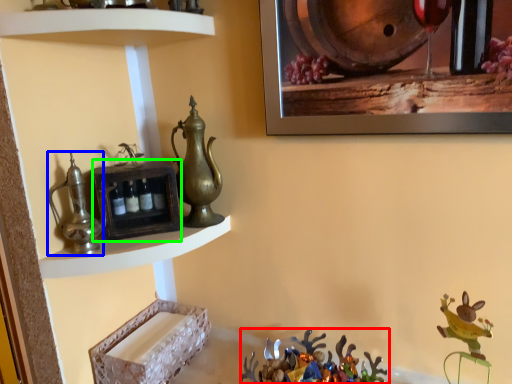
Question: Which object is the farthest from christmas decoration (highlighted by a red box)? Choose among these: jug (highlighted by a blue box) or shelf (highlighted by a green box).

Choices:
 (A) jug
 (B) shelf

Answer: (A)